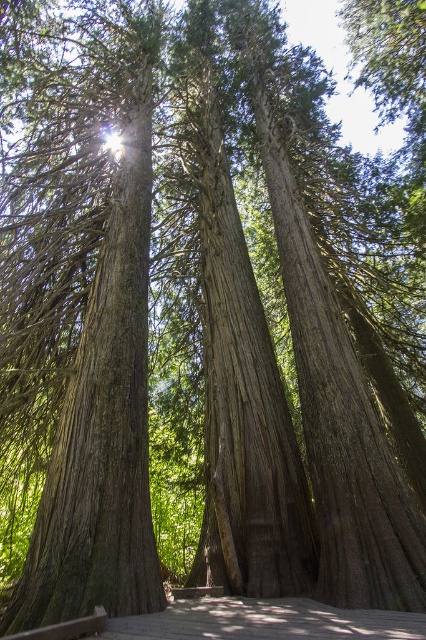
Can you confirm if smooth brown tree trunk at center is positioned above brown wooden park bench at center?

Yes, smooth brown tree trunk at center is above brown wooden park bench at center.

From the picture: Is smooth brown tree trunk at center thinner than brown wooden park bench at center?

Yes, smooth brown tree trunk at center is thinner than brown wooden park bench at center.

Does point (120, 285) come in front of point (181, 593)?

No, it is not.

Identify the location of smooth brown tree trunk at center. This screenshot has height=640, width=426. (104, 412).

Does smooth brown tree trunk at center have a lesser height compared to wooden walkway at center?

Indeed, smooth brown tree trunk at center has a lesser height compared to wooden walkway at center.

Is point (143, 49) farther from camera compared to point (157, 624)?

Yes, it is behind point (157, 624).

You are a GUI agent. You are given a task and a screenshot of the screen. Output one action in this format:
    pyautogui.click(x=<x>, y=<y>)
    Task: Click on the smooth brown tree trunk at center
    
    Given the screenshot: What is the action you would take?
    pyautogui.click(x=104, y=412)

I want to click on smooth brown tree trunk at center, so click(x=104, y=412).

In the scene shown: Can you confirm if wooden walkway at center is wider than brown wooden park bench at center?

Correct, the width of wooden walkway at center exceeds that of brown wooden park bench at center.

How much distance is there between wooden walkway at center and brown wooden park bench at center?

They are 1.48 meters apart.

Is point (222, 632) closer to camera compared to point (192, 589)?

Yes, it is in front of point (192, 589).

At what (x,y) coordinates should I click in order to perform the action: click on wooden walkway at center. Please return your answer as a coordinate pair (x, y). This screenshot has width=426, height=640. Looking at the image, I should click on (264, 621).